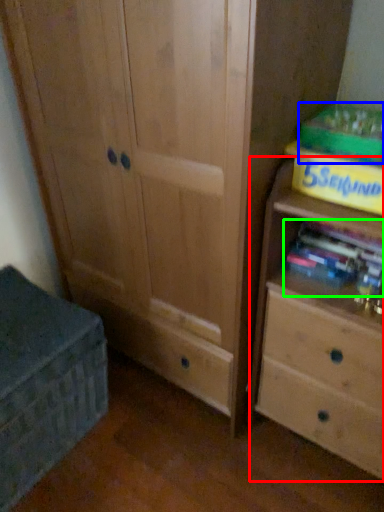
Question: Which is nearer to the chest of drawers (highlighted by a red box)? paperback book (highlighted by a blue box) or book (highlighted by a green box).

Choices:
 (A) paperback book
 (B) book

Answer: (B)